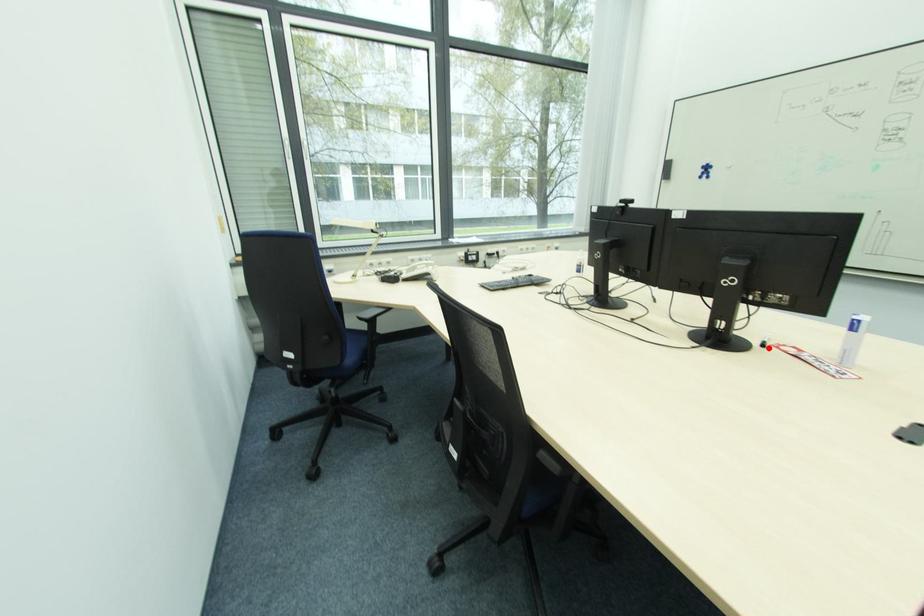
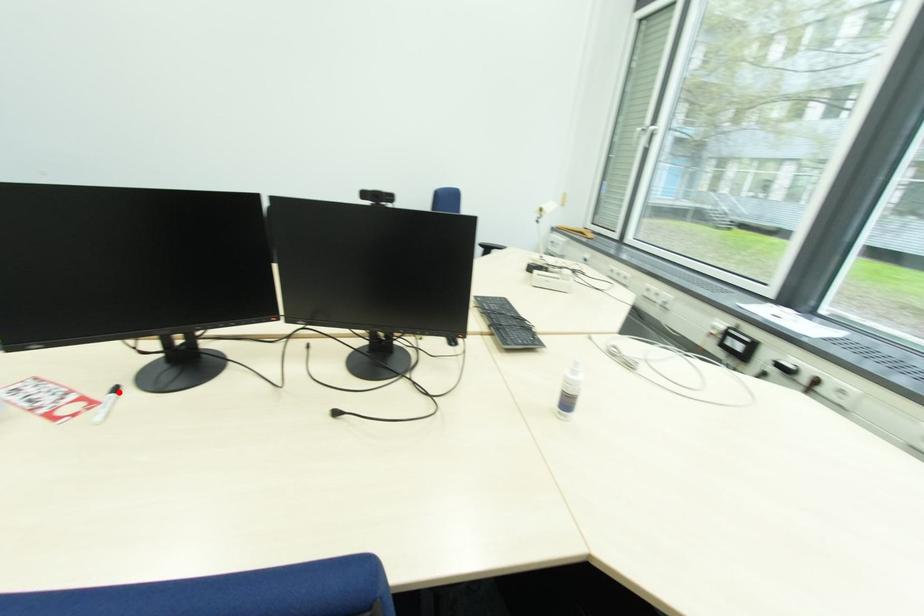
I am providing you with two images of the same scene from different viewpoints. A red point is marked on the first image and another point is marked on the second image. Is the marked point in image1 the same physical position as the marked point in image2?

Yes